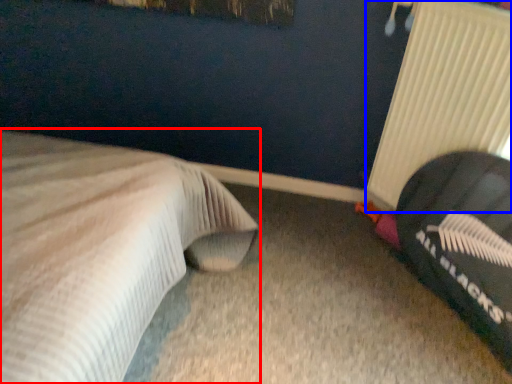
Question: Which of the following is the farthest to the observer, bed (highlighted by a red box) or radiator (highlighted by a blue box)?

Choices:
 (A) bed
 (B) radiator

Answer: (B)